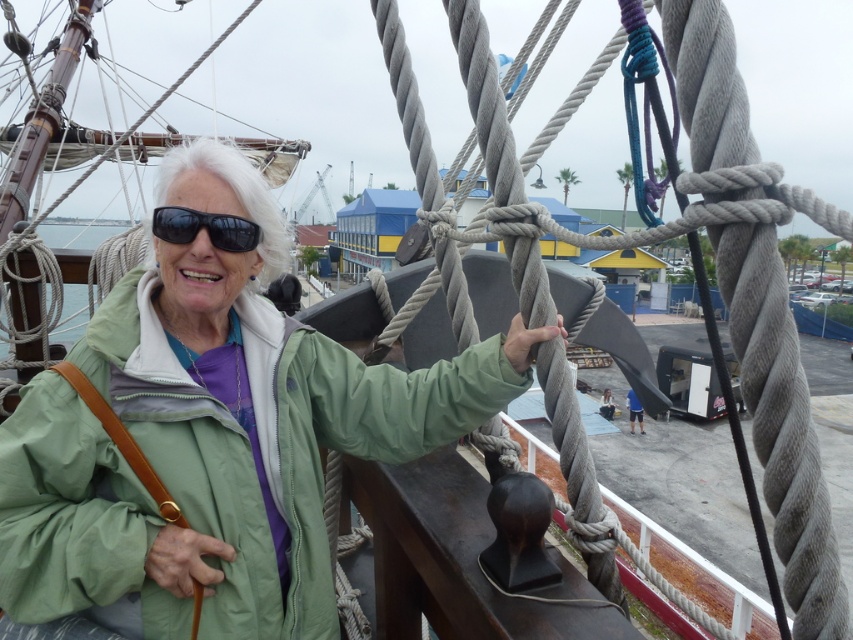
Does green matte jacket at center have a greater width compared to black matte sunglasses at upper left?

Yes, green matte jacket at center is wider than black matte sunglasses at upper left.

Does green matte jacket at center appear over black matte sunglasses at upper left?

No.

Image resolution: width=853 pixels, height=640 pixels. Describe the element at coordinates (213, 436) in the screenshot. I see `green matte jacket at center` at that location.

Identify the location of green matte jacket at center. (213, 436).